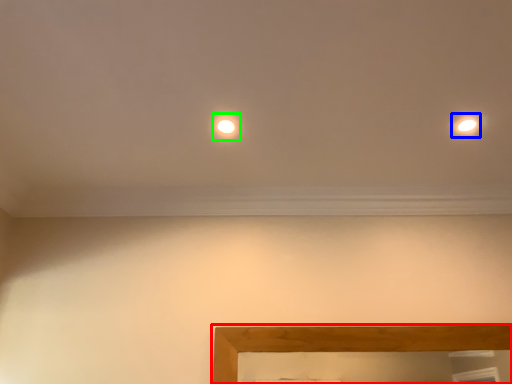
Question: Which is farther away from picture frame (highlighted by a red box)? light (highlighted by a blue box) or glow (highlighted by a green box)?

Choices:
 (A) light
 (B) glow

Answer: (B)